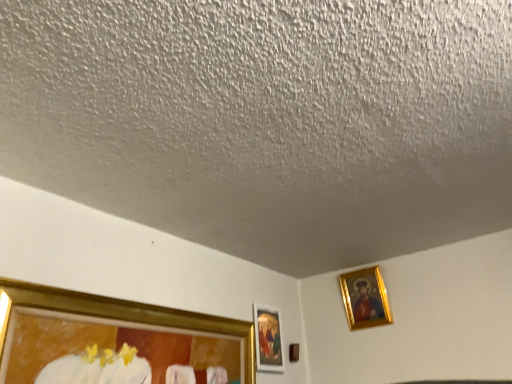
Where is `brown wooden picture frame at lower center, arranged as the second picture frame when viewed from the right`? This screenshot has width=512, height=384. brown wooden picture frame at lower center, arranged as the second picture frame when viewed from the right is located at coordinates (294, 352).

Find the location of `gold-framed painting at center, which appears as the 1th picture frame when viewed from the left`. gold-framed painting at center, which appears as the 1th picture frame when viewed from the left is located at coordinates (268, 339).

Is brown wooden picture frame at lower center, arranged as the second picture frame when viewed from the right, oriented away from gold metallic picture frame at upper right, positioned as the 1th picture frame in right-to-left order?

Answer: No, brown wooden picture frame at lower center, arranged as the second picture frame when viewed from the right, is not facing away from gold metallic picture frame at upper right, positioned as the 1th picture frame in right-to-left order.

Is brown wooden picture frame at lower center, arranged as the second picture frame when viewed from the right, positioned in front of gold metallic picture frame at upper right, positioned as the third picture frame in left-to-right order?

No, brown wooden picture frame at lower center, arranged as the second picture frame when viewed from the right, is further to the viewer.

How many degrees apart are the facing directions of brown wooden picture frame at lower center, arranged as the second picture frame when viewed from the right, and gold metallic picture frame at upper right, positioned as the third picture frame in left-to-right order?

The facing directions of brown wooden picture frame at lower center, arranged as the second picture frame when viewed from the right, and gold metallic picture frame at upper right, positioned as the third picture frame in left-to-right order, are 88.7 degrees apart.

From a real-world perspective, starting from the gold metallic picture frame at upper right, positioned as the third picture frame in left-to-right order, which picture frame is the 2nd one below it? Please provide its 2D coordinates.

[(294, 352)]

Is gold metallic picture frame at upper right, positioned as the 1th picture frame in right-to-left order, next to brown wooden picture frame at lower center, the second picture frame in the left-to-right sequence, and touching it?

gold metallic picture frame at upper right, positioned as the 1th picture frame in right-to-left order, and brown wooden picture frame at lower center, the second picture frame in the left-to-right sequence, are clearly separated.

Is gold metallic picture frame at upper right, positioned as the 1th picture frame in right-to-left order, oriented towards brown wooden picture frame at lower center, arranged as the second picture frame when viewed from the right?

No, gold metallic picture frame at upper right, positioned as the 1th picture frame in right-to-left order, does not turn towards brown wooden picture frame at lower center, arranged as the second picture frame when viewed from the right.

Does gold metallic picture frame at upper right, positioned as the 1th picture frame in right-to-left order, have a larger size compared to brown wooden picture frame at lower center, arranged as the second picture frame when viewed from the right?

Yes.

The image size is (512, 384). In order to click on picture frame that appears on the right of brown wooden picture frame at lower center, arranged as the second picture frame when viewed from the right in this screenshot , I will do `click(365, 298)`.

Based on the photo, from a real-world perspective, which object rests below the other?

In real-world perspective, gold-framed painting at center, which appears as the 1th picture frame when viewed from the left, is lower.

From a real-world perspective, starting from the gold metallic picture frame at upper right, positioned as the third picture frame in left-to-right order, which picture frame is the 1st one below it? Please provide its 2D coordinates.

[(268, 339)]

Could you tell me if gold-framed painting at center, which appears as the 1th picture frame when viewed from the left, is turned towards gold metallic picture frame at upper right, positioned as the third picture frame in left-to-right order?

No.

Considering the relative sizes of brown wooden picture frame at lower center, arranged as the second picture frame when viewed from the right, and gold-framed painting at center, which appears as the 1th picture frame when viewed from the left, in the image provided, is brown wooden picture frame at lower center, arranged as the second picture frame when viewed from the right, wider than gold-framed painting at center, which appears as the 1th picture frame when viewed from the left,?

No, brown wooden picture frame at lower center, arranged as the second picture frame when viewed from the right, is not wider than gold-framed painting at center, which appears as the 1th picture frame when viewed from the left.

Based on the photo, considering the relative positions of brown wooden picture frame at lower center, the second picture frame in the left-to-right sequence, and gold-framed painting at center, which appears as the 1th picture frame when viewed from the left, in the image provided, is brown wooden picture frame at lower center, the second picture frame in the left-to-right sequence, in front of gold-framed painting at center, which appears as the 1th picture frame when viewed from the left,?

No, it is behind gold-framed painting at center, which appears as the 1th picture frame when viewed from the left.

In the image, is brown wooden picture frame at lower center, the second picture frame in the left-to-right sequence, on the left side or the right side of gold-framed painting at center, which appears as the 1th picture frame when viewed from the left?

Based on their positions, brown wooden picture frame at lower center, the second picture frame in the left-to-right sequence, is located to the right of gold-framed painting at center, which appears as the 1th picture frame when viewed from the left.

Is brown wooden picture frame at lower center, the second picture frame in the left-to-right sequence, next to gold-framed painting at center, which ranks as the third picture frame in right-to-left order, and touching it?

No.

Between point (365, 272) and point (269, 348), which one is positioned in front?

Point (269, 348)

Is gold metallic picture frame at upper right, positioned as the 1th picture frame in right-to-left order, aimed at gold-framed painting at center, which appears as the 1th picture frame when viewed from the left?

No, gold metallic picture frame at upper right, positioned as the 1th picture frame in right-to-left order, is not aimed at gold-framed painting at center, which appears as the 1th picture frame when viewed from the left.

Visually, is gold metallic picture frame at upper right, positioned as the third picture frame in left-to-right order, positioned to the left or to the right of gold-framed painting at center, which appears as the 1th picture frame when viewed from the left?

gold metallic picture frame at upper right, positioned as the third picture frame in left-to-right order, is positioned on gold-framed painting at center, which appears as the 1th picture frame when viewed from the left,'s right side.

Is gold-framed painting at center, which ranks as the third picture frame in right-to-left order, oriented towards brown wooden picture frame at lower center, arranged as the second picture frame when viewed from the right?

No, gold-framed painting at center, which ranks as the third picture frame in right-to-left order, is not aimed at brown wooden picture frame at lower center, arranged as the second picture frame when viewed from the right.

Is gold-framed painting at center, which appears as the 1th picture frame when viewed from the left, touching brown wooden picture frame at lower center, the second picture frame in the left-to-right sequence?

gold-framed painting at center, which appears as the 1th picture frame when viewed from the left, and brown wooden picture frame at lower center, the second picture frame in the left-to-right sequence, are not in contact.

Find the location of a particular element. The width and height of the screenshot is (512, 384). picture frame on the left of brown wooden picture frame at lower center, the second picture frame in the left-to-right sequence is located at coordinates [268, 339].

Consider the image. Could brown wooden picture frame at lower center, the second picture frame in the left-to-right sequence, be considered to be inside gold-framed painting at center, which ranks as the third picture frame in right-to-left order?

No.

What are the coordinates of `the 1st picture frame in front when counting from the brown wooden picture frame at lower center, arranged as the second picture frame when viewed from the right` in the screenshot? It's located at (365, 298).

Starting from the gold metallic picture frame at upper right, positioned as the third picture frame in left-to-right order, which picture frame is the 1st one to the left? Please provide its 2D coordinates.

[(294, 352)]

Looking at the image, which one is located closer to brown wooden picture frame at lower center, the second picture frame in the left-to-right sequence, gold metallic picture frame at upper right, positioned as the 1th picture frame in right-to-left order, or gold-framed painting at center, which ranks as the third picture frame in right-to-left order?

gold-framed painting at center, which ranks as the third picture frame in right-to-left order, is closer to brown wooden picture frame at lower center, the second picture frame in the left-to-right sequence.

Estimate the real-world distances between objects in this image. Which object is further from brown wooden picture frame at lower center, the second picture frame in the left-to-right sequence, gold-framed painting at center, which ranks as the third picture frame in right-to-left order, or gold metallic picture frame at upper right, positioned as the 1th picture frame in right-to-left order?

Based on the image, gold metallic picture frame at upper right, positioned as the 1th picture frame in right-to-left order, appears to be further to brown wooden picture frame at lower center, the second picture frame in the left-to-right sequence.

Based on their spatial positions, is brown wooden picture frame at lower center, the second picture frame in the left-to-right sequence, or gold metallic picture frame at upper right, positioned as the third picture frame in left-to-right order, further from gold-framed painting at center, which appears as the 1th picture frame when viewed from the left?

gold metallic picture frame at upper right, positioned as the third picture frame in left-to-right order, is further to gold-framed painting at center, which appears as the 1th picture frame when viewed from the left.

Considering their positions, is gold-framed painting at center, which appears as the 1th picture frame when viewed from the left, positioned closer to gold metallic picture frame at upper right, positioned as the 1th picture frame in right-to-left order, than brown wooden picture frame at lower center, the second picture frame in the left-to-right sequence?

brown wooden picture frame at lower center, the second picture frame in the left-to-right sequence, lies closer to gold metallic picture frame at upper right, positioned as the 1th picture frame in right-to-left order, than the other object.

Which object lies further to the anchor point gold-framed painting at center, which appears as the 1th picture frame when viewed from the left, gold metallic picture frame at upper right, positioned as the 1th picture frame in right-to-left order, or brown wooden picture frame at lower center, arranged as the second picture frame when viewed from the right?

Based on the image, gold metallic picture frame at upper right, positioned as the 1th picture frame in right-to-left order, appears to be further to gold-framed painting at center, which appears as the 1th picture frame when viewed from the left.

From the picture: From the image, which object appears to be nearer to gold metallic picture frame at upper right, positioned as the third picture frame in left-to-right order, brown wooden picture frame at lower center, arranged as the second picture frame when viewed from the right, or gold-framed painting at center, which appears as the 1th picture frame when viewed from the left?

brown wooden picture frame at lower center, arranged as the second picture frame when viewed from the right, is positioned closer to the anchor gold metallic picture frame at upper right, positioned as the third picture frame in left-to-right order.

The width and height of the screenshot is (512, 384). I want to click on picture frame between gold-framed painting at center, which appears as the 1th picture frame when viewed from the left, and gold metallic picture frame at upper right, positioned as the 1th picture frame in right-to-left order, in the horizontal direction, so click(294, 352).